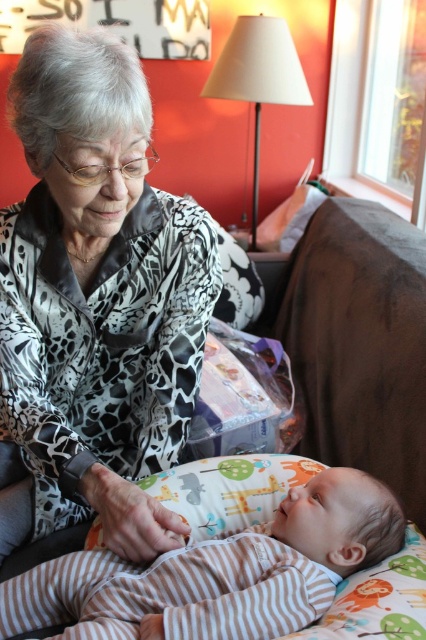
In the scene shown: You are a photographer setting up a shoot in this room. You need to position a new light source between the striped cotton onesie at lower center and the white fabric lampshade at upper center. Based on their positions, which object should the light be closer to?

The striped cotton onesie at lower center is in front of the white fabric lampshade at upper center. Since the onesie is closer to the viewer, the light source should be positioned closer to the striped cotton onesie at lower center to properly illuminate it.

You are a photographer standing in front of the camera. You want to take a closeup shot of the silky leopard print blouse at center. The camera has a minimum focusing distance of 30 inches. Can you take the photo without moving the blouse?

The distance between the silky leopard print blouse at center and the camera is 29.08 inches, which is less than the camera minimum focusing distance of 30 inches. Therefore, the camera cannot focus properly to take the photo without moving the blouse closer.

You are a photographer setting up for a family photo. You see the silky leopard print blouse at center and the striped cotton onesie at lower center in the frame. Which clothing item is positioned higher in the image?

The silky leopard print blouse at center is taller than striped cotton onesie at lower center, so it is positioned higher in the image.